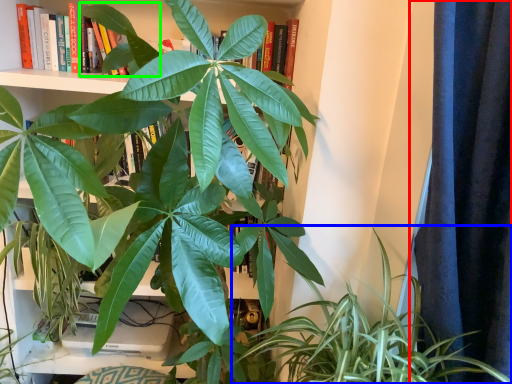
Question: Estimate the real-world distances between objects in this image. Which object is closer to curtain (highlighted by a red box), houseplant (highlighted by a blue box) or leaf (highlighted by a green box)?

Choices:
 (A) houseplant
 (B) leaf

Answer: (A)